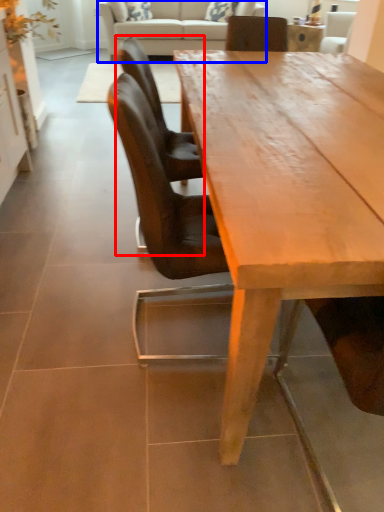
Question: Among these objects, which one is farthest to the camera, chair (highlighted by a red box) or studio couch (highlighted by a blue box)?

Choices:
 (A) chair
 (B) studio couch

Answer: (B)